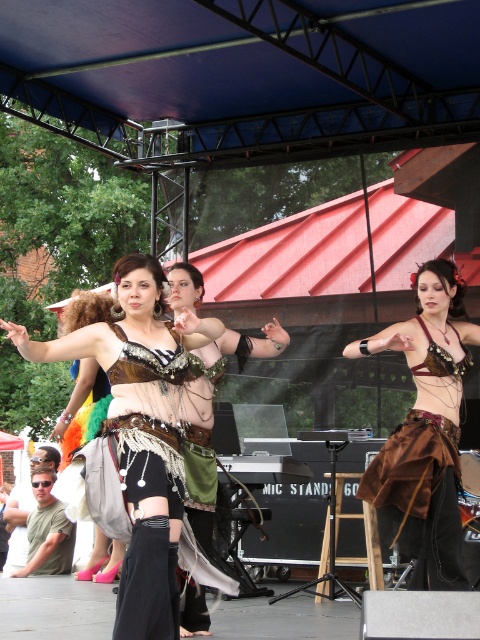
Is shiny silver belt at center in front of brown velvet skirt at center?

Yes, shiny silver belt at center is closer to the viewer.

Can you confirm if shiny silver belt at center is taller than brown velvet skirt at center?

Incorrect, shiny silver belt at center's height is not larger of brown velvet skirt at center's.

The image size is (480, 640). What do you see at coordinates (141, 432) in the screenshot?
I see `shiny silver belt at center` at bounding box center [141, 432].

At what (x,y) coordinates should I click in order to perform the action: click on shiny silver belt at center. Please return your answer as a coordinate pair (x, y). The width and height of the screenshot is (480, 640). Looking at the image, I should click on (141, 432).

Who is higher up, brown velvet skirt at center or shiny metallic bra at center?

brown velvet skirt at center is above.

Consider the image. Does brown velvet skirt at center appear over shiny metallic bra at center?

Yes.

Measure the distance between point [452,289] and camera.

The distance of point [452,289] from camera is 5.89 meters.

The image size is (480, 640). In order to click on brown velvet skirt at center in this screenshot , I will do `click(425, 428)`.

Looking at this image, who is taller, shiny silver belt at center or shiny metallic bra at center?

shiny silver belt at center

Is shiny silver belt at center closer to camera compared to shiny metallic bra at center?

No, shiny silver belt at center is further to the viewer.

Between point (155, 470) and point (136, 310), which one is positioned behind?

The point (136, 310) is behind.

Find the location of a particular element. This screenshot has height=640, width=480. shiny silver belt at center is located at coordinates (141, 432).